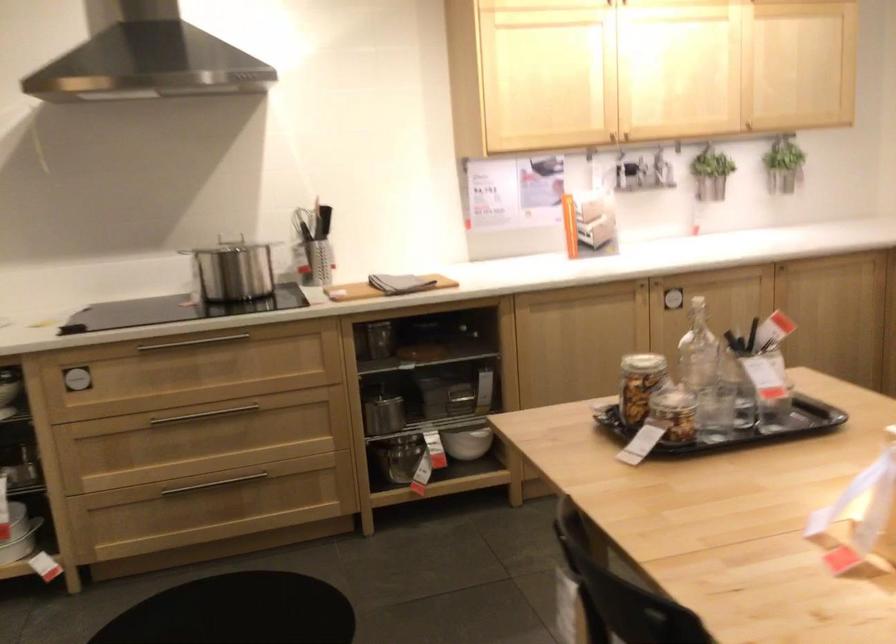
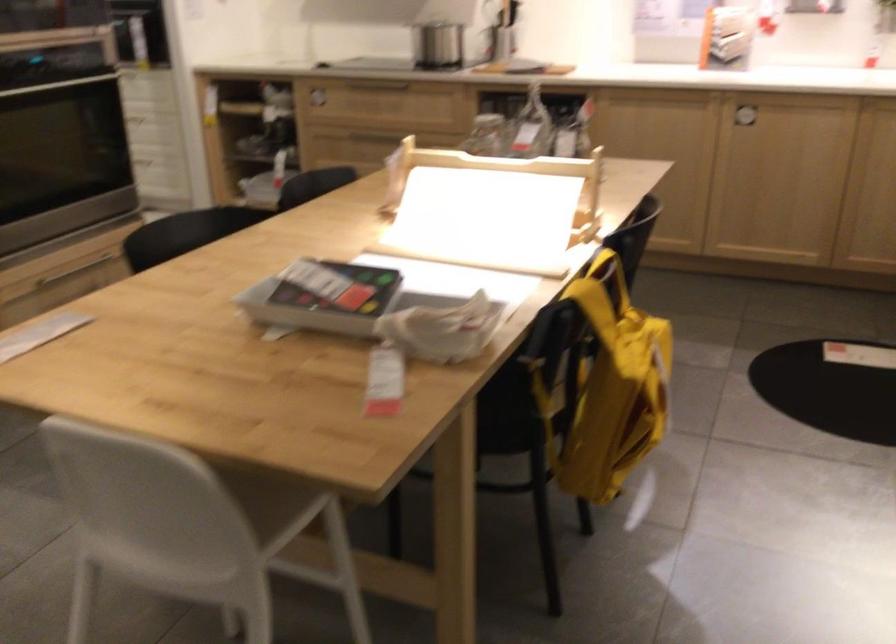
Locate, in the second image, the point that corresponds to (x=92, y=390) in the first image.

(316, 100)